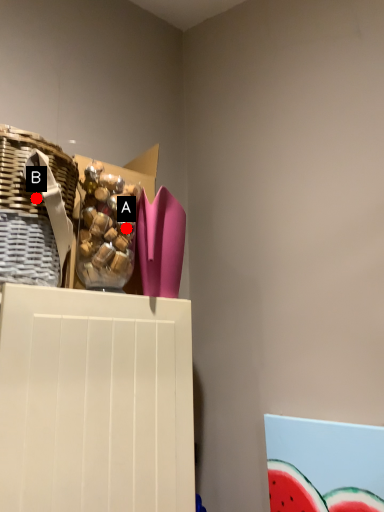
Question: Two points are circled on the image, labeled by A and B beside each circle. Which point is closer to the camera?

Choices:
 (A) A is closer
 (B) B is closer

Answer: (B)